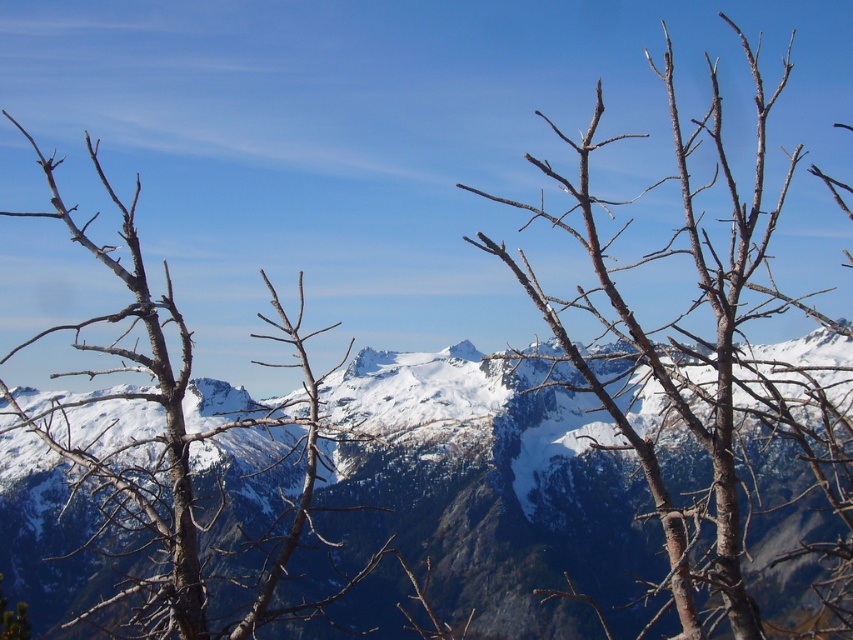
Which is below, brown/dry wood branches at center or brown/dry wood tree at center?

Positioned lower is brown/dry wood tree at center.

Does brown/dry wood branches at center lie in front of brown/dry wood tree at center?

Yes, brown/dry wood branches at center is closer to the viewer.

Does point (730, 621) lie in front of point (123, 314)?

No, (730, 621) is behind (123, 314).

Where is `brown/dry wood branches at center`? The height and width of the screenshot is (640, 853). brown/dry wood branches at center is located at coordinates (708, 364).

Does snowy rock mountain range at center have a lesser width compared to brown/dry wood tree at center?

In fact, snowy rock mountain range at center might be wider than brown/dry wood tree at center.

Is snowy rock mountain range at center wider than brown/dry wood tree at center?

Yes, snowy rock mountain range at center is wider than brown/dry wood tree at center.

Identify the location of snowy rock mountain range at center. (480, 492).

Locate an element on the screen. snowy rock mountain range at center is located at coordinates (480, 492).

Does snowy rock mountain range at center appear under brown/dry wood branches at center?

Indeed, snowy rock mountain range at center is positioned under brown/dry wood branches at center.

The height and width of the screenshot is (640, 853). What do you see at coordinates (480, 492) in the screenshot?
I see `snowy rock mountain range at center` at bounding box center [480, 492].

What do you see at coordinates (480, 492) in the screenshot? The image size is (853, 640). I see `snowy rock mountain range at center` at bounding box center [480, 492].

Identify the location of snowy rock mountain range at center. The width and height of the screenshot is (853, 640). coord(480,492).